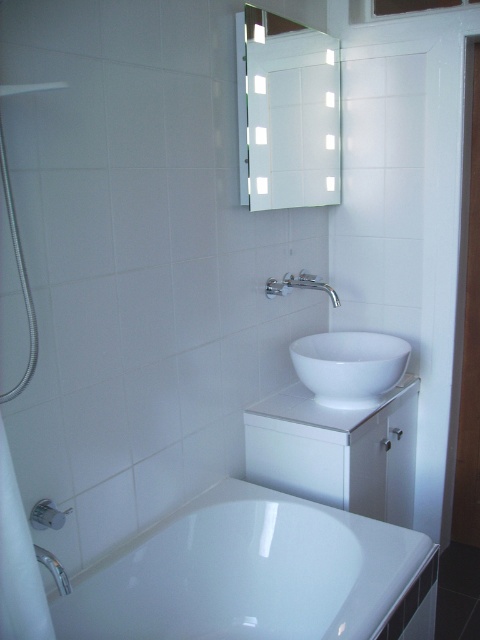
You are standing in the bathroom and want to reach both the point at coordinates point [319,140] and the point at coordinates point [57,512]. Which point will you reach first?

You will reach the point [319,140] first because it is closer to you than the point [57,512], which is further away.

You are a contractor measuring the bathroom layout. You have a point marked at coordinates (289, 113). Based on the scene description, where is this point located?

The point at coordinates (289, 113) is located on the white glossy mirror at upper center.

You are designing a layout for a bathroom and need to ensure that the white glossy mirror at upper center and the brushed metal faucet at lower left are positioned correctly. Based on the image, which object is wider?

The white glossy mirror at upper center is wider than the brushed metal faucet at lower left according to the description.